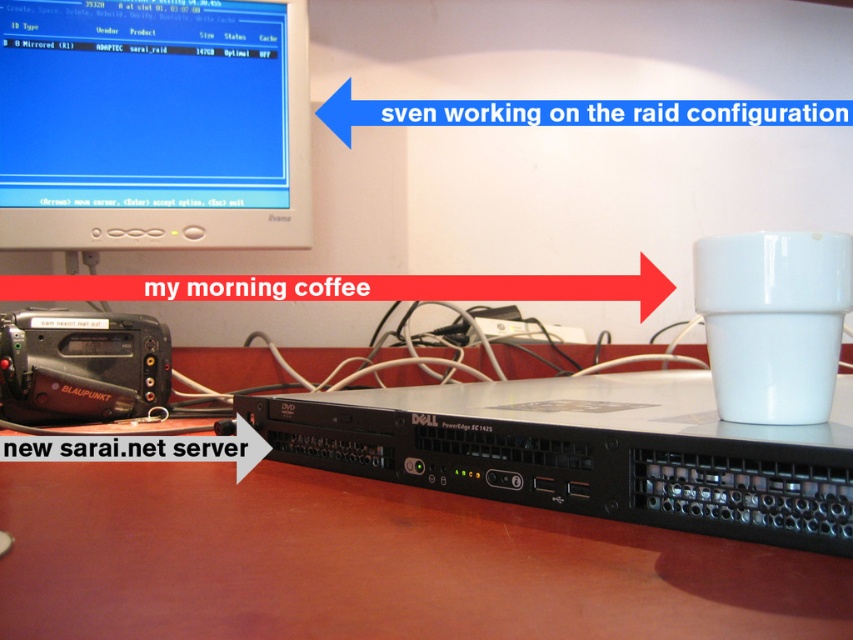
Question: Where is matte plastic monitor at upper left located in relation to white glossy mug at right in the image?

Choices:
 (A) above
 (B) below

Answer: (A)

Question: Which point is farther to the camera?

Choices:
 (A) black plastic server at center
 (B) matte plastic monitor at upper left
 (C) white glossy mug at right
 (D) brown wooden table at center

Answer: (B)

Question: Can you confirm if black plastic server at center is positioned to the right of white glossy mug at right?

Choices:
 (A) yes
 (B) no

Answer: (B)

Question: Which of the following is the farthest from the observer?

Choices:
 (A) (575, 481)
 (B) (815, 289)
 (C) (115, 484)
 (D) (55, 179)

Answer: (D)

Question: Which point is farther to the camera?

Choices:
 (A) white glossy mug at right
 (B) black plastic server at center
 (C) matte plastic monitor at upper left

Answer: (C)

Question: Does matte plastic monitor at upper left come behind black plastic server at center?

Choices:
 (A) yes
 (B) no

Answer: (A)